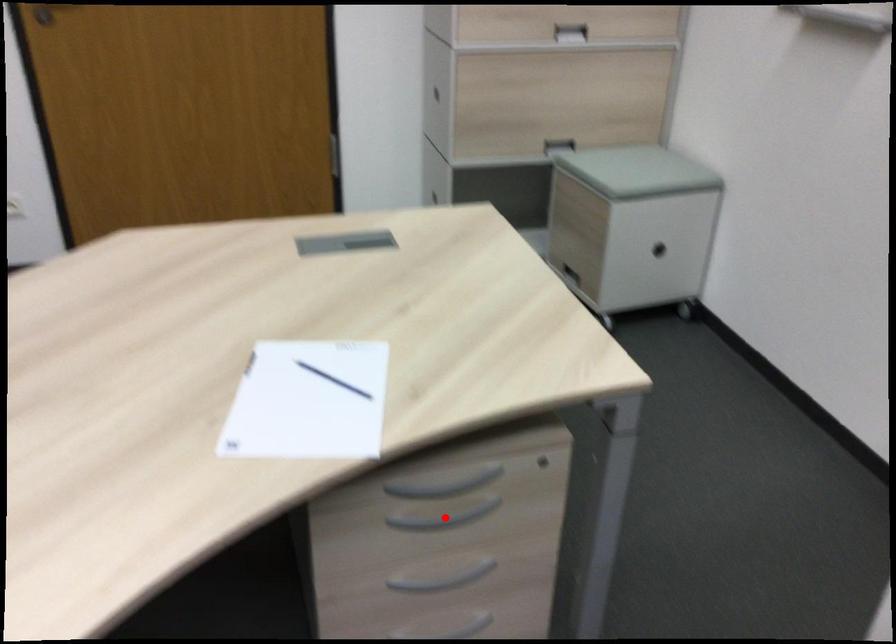
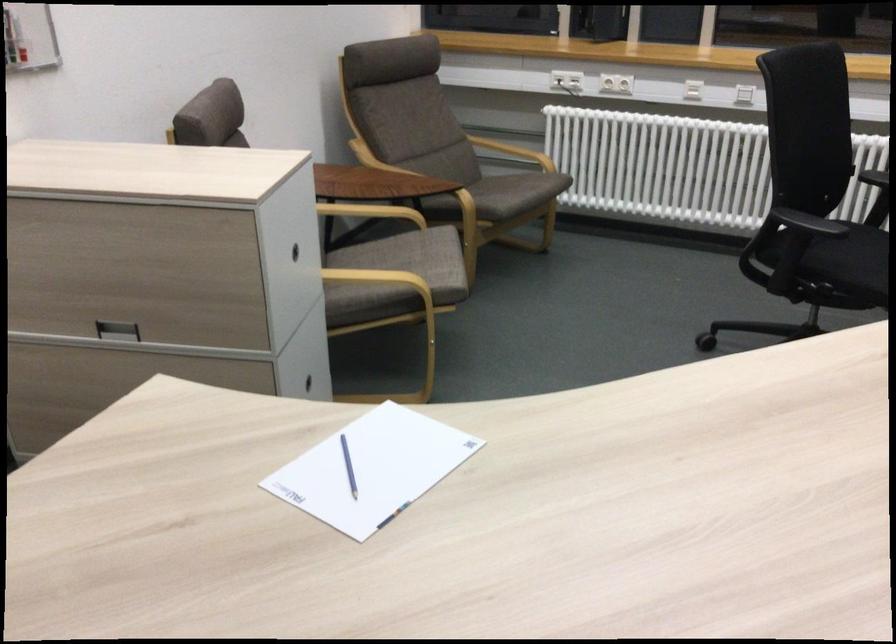
Question: I am providing you with two images of the same scene from different viewpoints. A red point is marked on the first image. Is the red point's position out of view in image 2?

Choices:
 (A) Yes
 (B) No

Answer: (A)